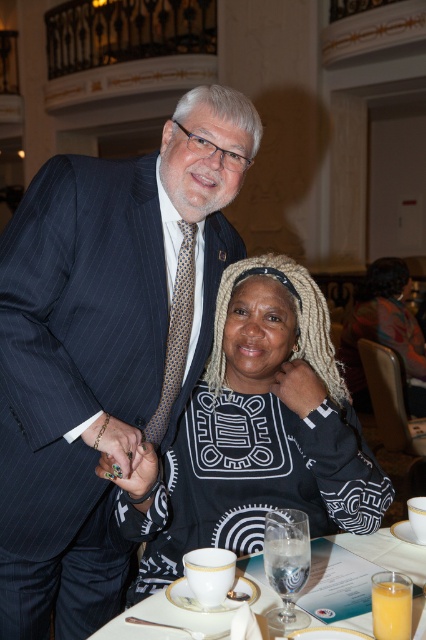
Question: Is pinstriped suit at upper left in front of white ceramic cup at lower center?

Choices:
 (A) no
 (B) yes

Answer: (A)

Question: Which point is farther to the camera?

Choices:
 (A) black matte sweater at center
 (B) black textured sweater at center
 (C) white ceramic cup at lower center

Answer: (B)

Question: Can you confirm if black textured sweater at center is smaller than white ceramic cup at lower center?

Choices:
 (A) yes
 (B) no

Answer: (B)

Question: Based on their relative distances, which object is farther from the black matte sweater at center?

Choices:
 (A) black textured sweater at center
 (B) white ceramic cup at lower center

Answer: (A)

Question: Can you confirm if pinstriped suit at upper left is wider than white ceramic cup at lower center?

Choices:
 (A) no
 (B) yes

Answer: (A)

Question: Which of the following is the closest to the observer?

Choices:
 (A) black matte sweater at center
 (B) white ceramic cup at lower center
 (C) black textured sweater at center

Answer: (B)